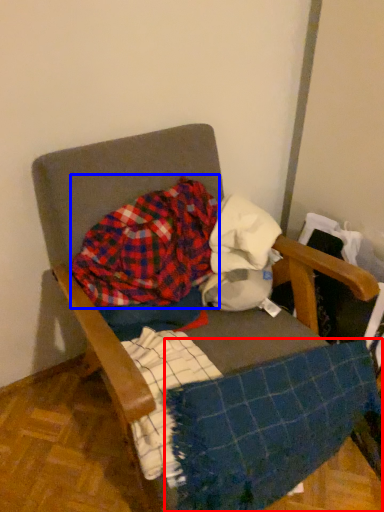
Question: Which point is closer to the camera, blanket (highlighted by a red box) or flannel (highlighted by a blue box)?

Choices:
 (A) blanket
 (B) flannel

Answer: (A)